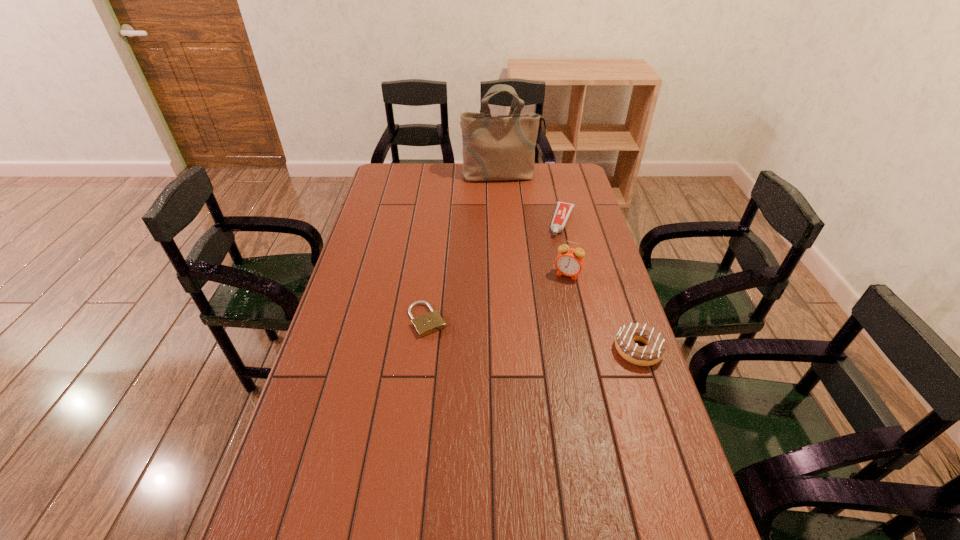
Identify the location of vacant area located on the left of the padlock. 374,320.

The image size is (960, 540). What are the coordinates of `vacant space located 0.240m on the front of the third tallest object` in the screenshot? It's located at (673, 454).

Image resolution: width=960 pixels, height=540 pixels. What are the coordinates of `vacant space positioned 0.220m on the face of the third nearest object` in the screenshot? It's located at (544, 326).

This screenshot has width=960, height=540. I want to click on vacant space located 0.060m on the face of the third nearest object, so click(x=559, y=293).

You are a GUI agent. You are given a task and a screenshot of the screen. Output one action in this format:
    pyautogui.click(x=<x>, y=<y>)
    Task: Click on the vacant space located on the face of the third nearest object
    The height and width of the screenshot is (540, 960).
    Given the screenshot: What is the action you would take?
    pyautogui.click(x=560, y=291)

This screenshot has width=960, height=540. In order to click on vacant region located 0.270m on the front-facing side of the farthest object in this screenshot , I will do `click(515, 219)`.

Locate an element on the screen. blank space located 0.130m on the front-facing side of the farthest object is located at coordinates (510, 200).

Find the location of a particular element. This screenshot has height=540, width=960. free space located on the front-facing side of the farthest object is located at coordinates (517, 230).

This screenshot has height=540, width=960. Identify the location of free spot located 0.210m at the nozzle of the toothpaste. (549, 272).

Find the location of a particular element. Image resolution: width=960 pixels, height=540 pixels. free space located 0.160m at the nozzle of the toothpaste is located at coordinates (552, 264).